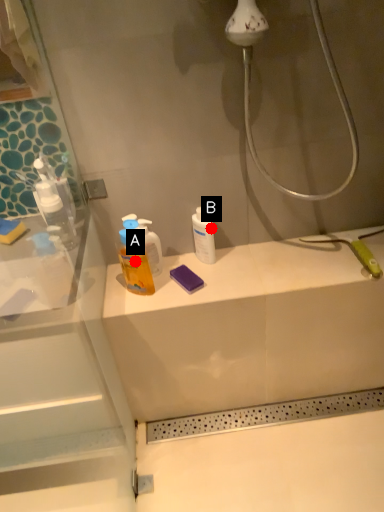
Question: Two points are circled on the image, labeled by A and B beside each circle. Among these points, which one is farthest from the camera?

Choices:
 (A) A is further
 (B) B is further

Answer: (B)